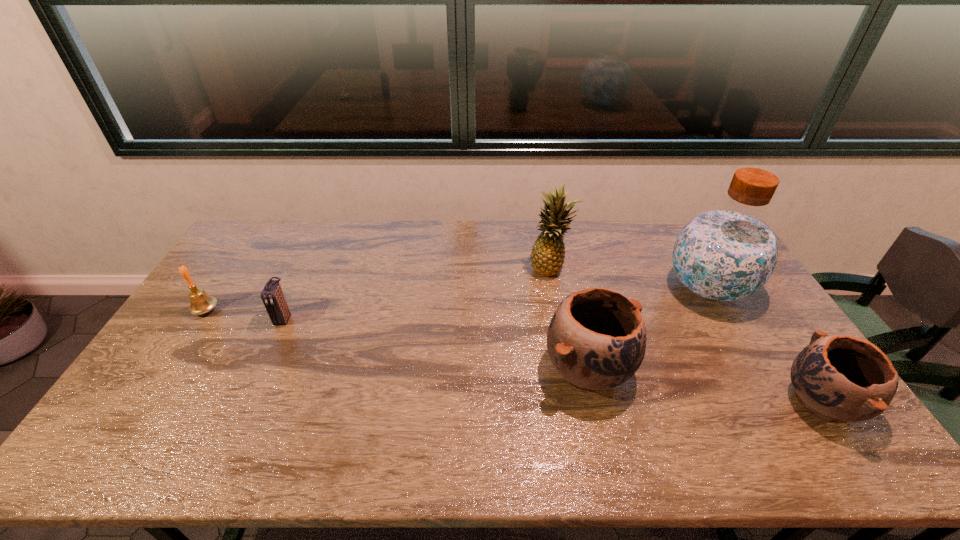
Where is `the left pottery`? Image resolution: width=960 pixels, height=540 pixels. the left pottery is located at coordinates (596, 340).

Identify the location of the fourth shortest object. This screenshot has height=540, width=960. (596, 340).

I want to click on the shorter pottery, so click(838, 378).

Find the location of a particular element. water jug is located at coordinates (728, 253).

You are a GUI agent. You are given a task and a screenshot of the screen. Output one action in this format:
    pyautogui.click(x=<x>, y=<y>)
    Task: Click on the second tallest object
    
    Given the screenshot: What is the action you would take?
    pyautogui.click(x=548, y=253)

The image size is (960, 540). I want to click on the fifth object from right to left, so click(272, 295).

Find the location of a particular element. This screenshot has height=540, width=960. clutch bag is located at coordinates (272, 295).

Where is `the leftmost object`? The height and width of the screenshot is (540, 960). the leftmost object is located at coordinates (201, 302).

In order to click on vacant area situated 0.360m on the left of the taller pottery in this screenshot , I will do pos(413,369).

Identify the location of free region located 0.290m on the back of the shorter pottery. [x=749, y=294].